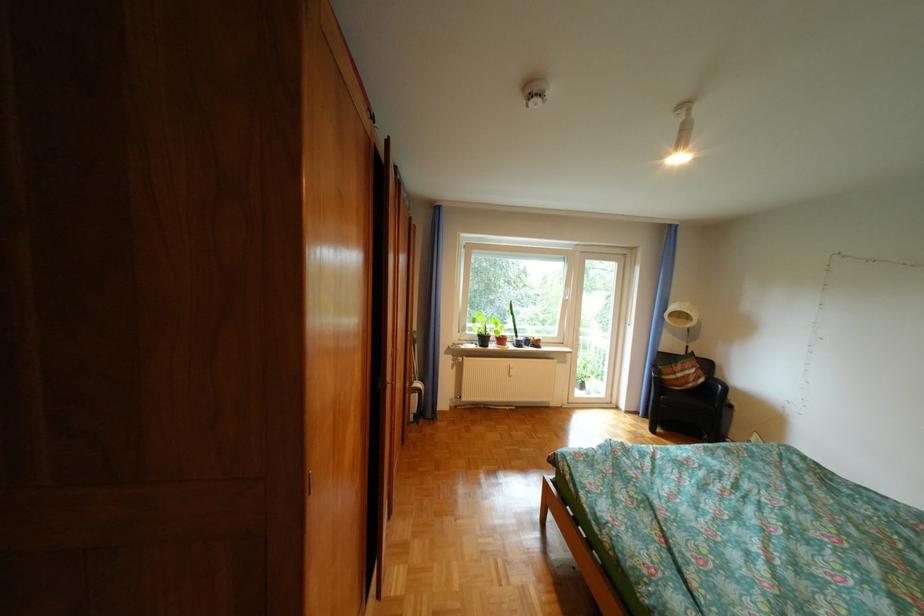
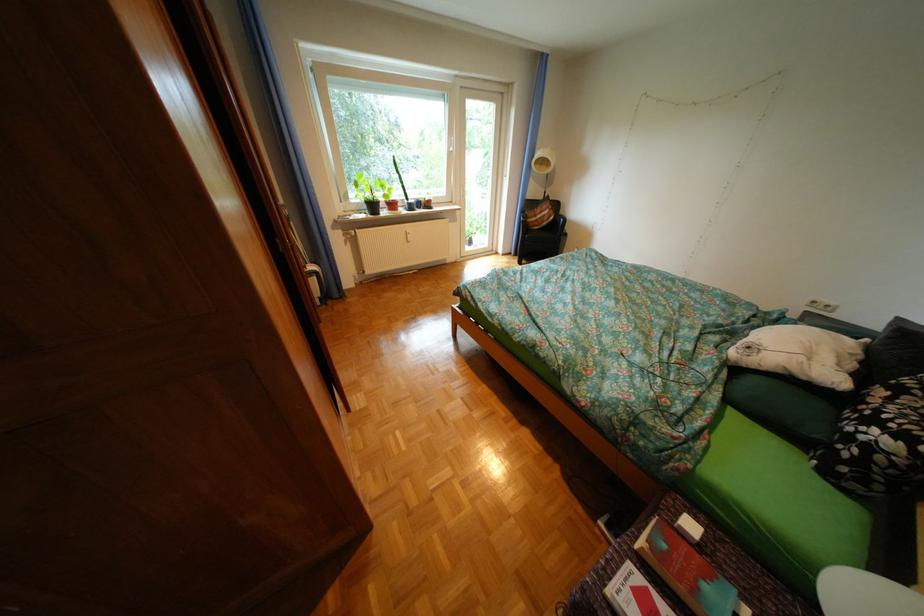
Find the pixel in the second image that matches (x=482, y=333) in the first image.

(368, 201)